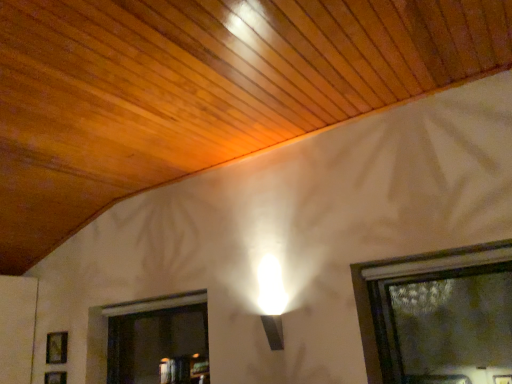
Question: Is wooden picture frame at lower left, acting as the 2th picture frame starting from the top, thinner than wooden frame at lower left, placed as the first picture frame when sorted from top to bottom?

Choices:
 (A) yes
 (B) no

Answer: (A)

Question: Can you see wooden picture frame at lower left, acting as the 2th picture frame starting from the top, touching wooden frame at lower left, which is the 2th picture frame from bottom to top?

Choices:
 (A) no
 (B) yes

Answer: (A)

Question: Is wooden frame at lower left, which is the 2th picture frame from bottom to top, located within wooden picture frame at lower left, acting as the 2th picture frame starting from the top?

Choices:
 (A) yes
 (B) no

Answer: (B)

Question: From the image's perspective, is wooden picture frame at lower left, acting as the 2th picture frame starting from the top, beneath wooden frame at lower left, which is the 2th picture frame from bottom to top?

Choices:
 (A) yes
 (B) no

Answer: (A)

Question: Does wooden picture frame at lower left, acting as the 2th picture frame starting from the top, appear on the right side of wooden frame at lower left, placed as the first picture frame when sorted from top to bottom?

Choices:
 (A) no
 (B) yes

Answer: (B)

Question: Is wooden picture frame at lower left, which is the 1th picture frame in bottom-to-top order, positioned behind wooden frame at lower left, which is the 2th picture frame from bottom to top?

Choices:
 (A) yes
 (B) no

Answer: (B)

Question: Is wooden frame at lower left, placed as the first picture frame when sorted from top to bottom, not close to wooden picture frame at lower left, acting as the 2th picture frame starting from the top?

Choices:
 (A) no
 (B) yes

Answer: (A)

Question: Is wooden picture frame at lower left, acting as the 2th picture frame starting from the top, at the back of wooden frame at lower left, which is the 2th picture frame from bottom to top?

Choices:
 (A) no
 (B) yes

Answer: (A)

Question: Considering the relative sizes of wooden frame at lower left, which is the 2th picture frame from bottom to top, and wooden picture frame at lower left, which is the 1th picture frame in bottom-to-top order, in the image provided, is wooden frame at lower left, which is the 2th picture frame from bottom to top, wider than wooden picture frame at lower left, which is the 1th picture frame in bottom-to-top order,?

Choices:
 (A) yes
 (B) no

Answer: (A)

Question: Is wooden frame at lower left, placed as the first picture frame when sorted from top to bottom, further to camera compared to wooden picture frame at lower left, which is the 1th picture frame in bottom-to-top order?

Choices:
 (A) no
 (B) yes

Answer: (B)

Question: From the image's perspective, is wooden frame at lower left, which is the 2th picture frame from bottom to top, over wooden picture frame at lower left, acting as the 2th picture frame starting from the top?

Choices:
 (A) no
 (B) yes

Answer: (B)

Question: Can you confirm if wooden frame at lower left, placed as the first picture frame when sorted from top to bottom, is positioned to the right of wooden picture frame at lower left, which is the 1th picture frame in bottom-to-top order?

Choices:
 (A) no
 (B) yes

Answer: (A)

Question: Visually, is wooden picture frame at lower left, which is the 1th picture frame in bottom-to-top order, positioned to the left or to the right of wooden frame at lower left, placed as the first picture frame when sorted from top to bottom?

Choices:
 (A) left
 (B) right

Answer: (B)